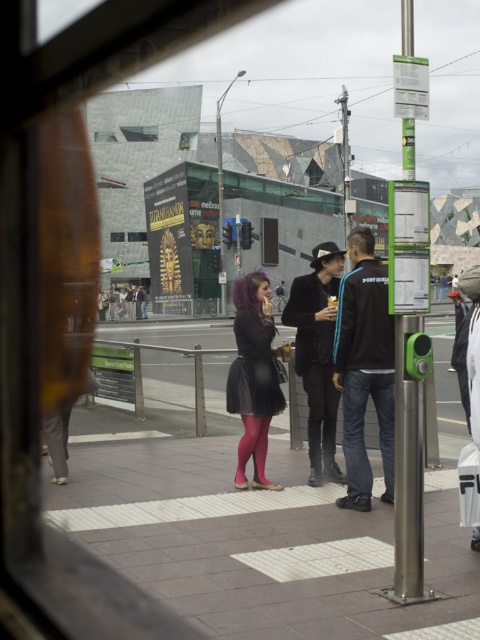
Question: Which point is farther to the camera?

Choices:
 (A) (277, 627)
 (B) (261, 228)
 (C) (357, 378)
 (D) (312, 282)

Answer: (B)

Question: Which object is farther from the camera taking this photo?

Choices:
 (A) matte black jacket at center
 (B) transparent glass window at center

Answer: (B)

Question: Can you confirm if matte black jacket at center is wider than matte black dress at center?

Choices:
 (A) yes
 (B) no

Answer: (B)

Question: Where is matte black jacket at center located in relation to polished metal pole at right in the image?

Choices:
 (A) above
 (B) below

Answer: (B)

Question: Can you confirm if smooth concrete pavement at center is positioned above matte black jacket at center?

Choices:
 (A) no
 (B) yes

Answer: (A)

Question: Which point is farther to the camera?

Choices:
 (A) transparent glass window at center
 (B) smooth concrete pavement at center
 (C) polished metal pole at right

Answer: (A)